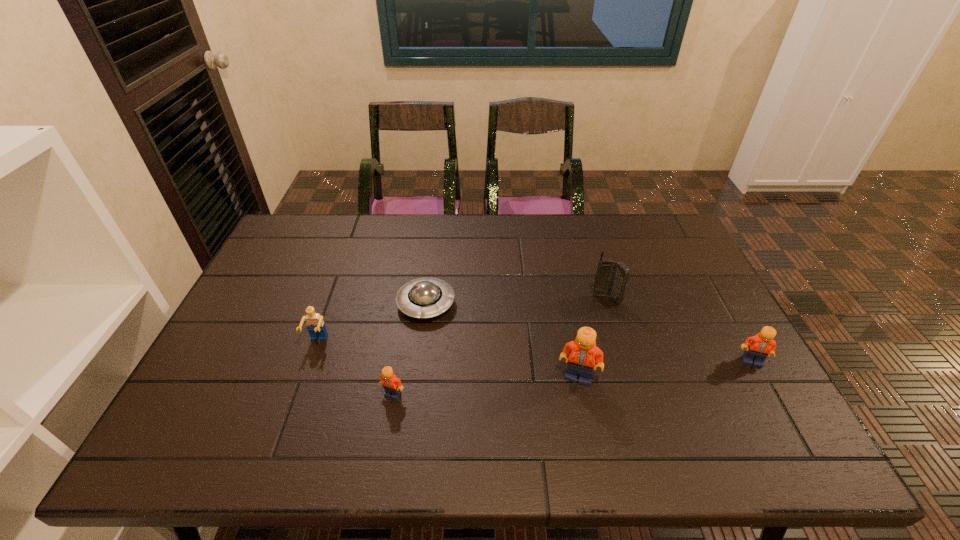
Where is `the nearest Lego`? Image resolution: width=960 pixels, height=540 pixels. the nearest Lego is located at coordinates (392, 385).

Identify the location of the third Lego from right to left. The height and width of the screenshot is (540, 960). (392, 385).

The width and height of the screenshot is (960, 540). I want to click on the third Lego from left to right, so click(x=582, y=353).

I want to click on the tallest Lego, so click(582, 353).

Image resolution: width=960 pixels, height=540 pixels. Find the location of `the rightmost Lego`. the rightmost Lego is located at coordinates (758, 347).

This screenshot has height=540, width=960. What are the coordinates of `the fifth object from left to right` in the screenshot? It's located at (611, 278).

Where is `the leftmost object`? The height and width of the screenshot is (540, 960). the leftmost object is located at coordinates (315, 325).

Find the location of a particular element. the farthest Lego is located at coordinates (315, 325).

Locate an element on the screen. saucer is located at coordinates (425, 297).

In order to click on vacant space situated on the keyboard of the cellular telephone in this screenshot , I will do `click(631, 381)`.